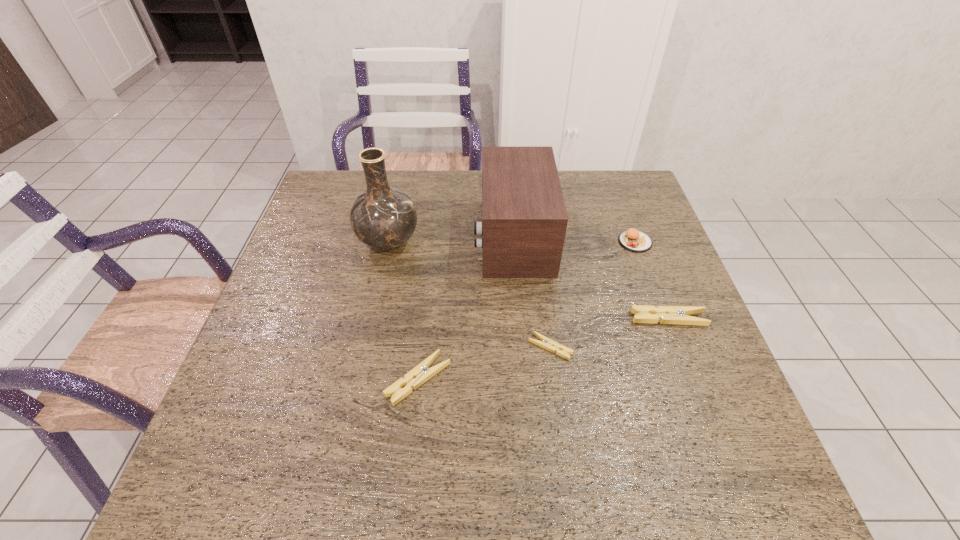
Find the location of a particular element. the second tallest clothespin is located at coordinates (421, 373).

The image size is (960, 540). What are the coordinates of `the fifth tallest object` in the screenshot? It's located at (421, 373).

Locate an element on the screen. Image resolution: width=960 pixels, height=540 pixels. the shortest object is located at coordinates (546, 343).

Find the location of a particular element. The height and width of the screenshot is (540, 960). the shortest clothespin is located at coordinates (546, 343).

Locate an element on the screen. the fourth farthest object is located at coordinates (678, 315).

Where is `the farthest clothespin`? The width and height of the screenshot is (960, 540). the farthest clothespin is located at coordinates (678, 315).

At what (x,y) coordinates should I click in order to perform the action: click on the fifth shortest object. Please return your answer as a coordinate pair (x, y). Looking at the image, I should click on (524, 220).

What are the coordinates of `vase` in the screenshot? It's located at (384, 218).

Locate an element on the screen. This screenshot has width=960, height=540. the third tallest object is located at coordinates (633, 240).

Find the location of a particular element. The height and width of the screenshot is (540, 960). vacant region located 0.230m on the back of the leftmost clothespin is located at coordinates (429, 279).